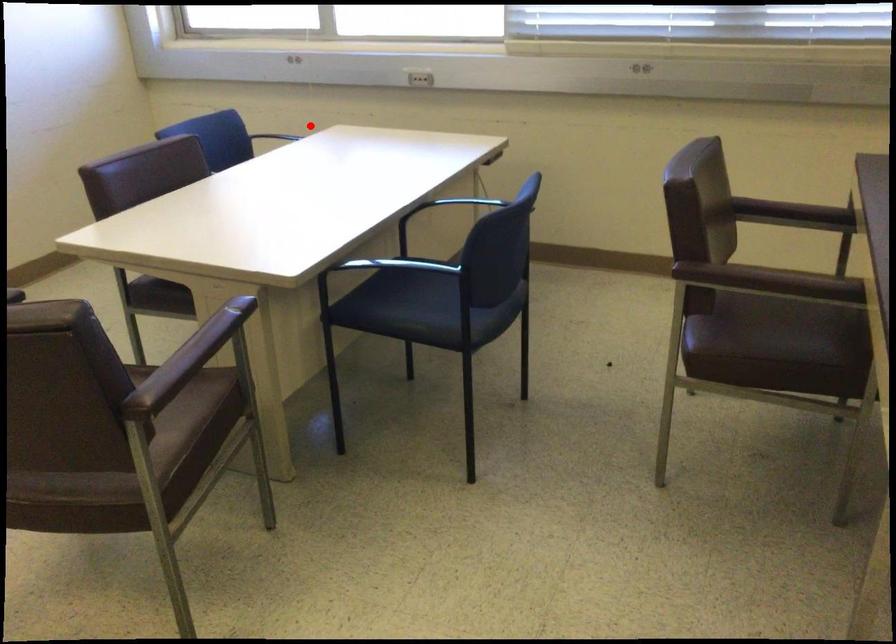
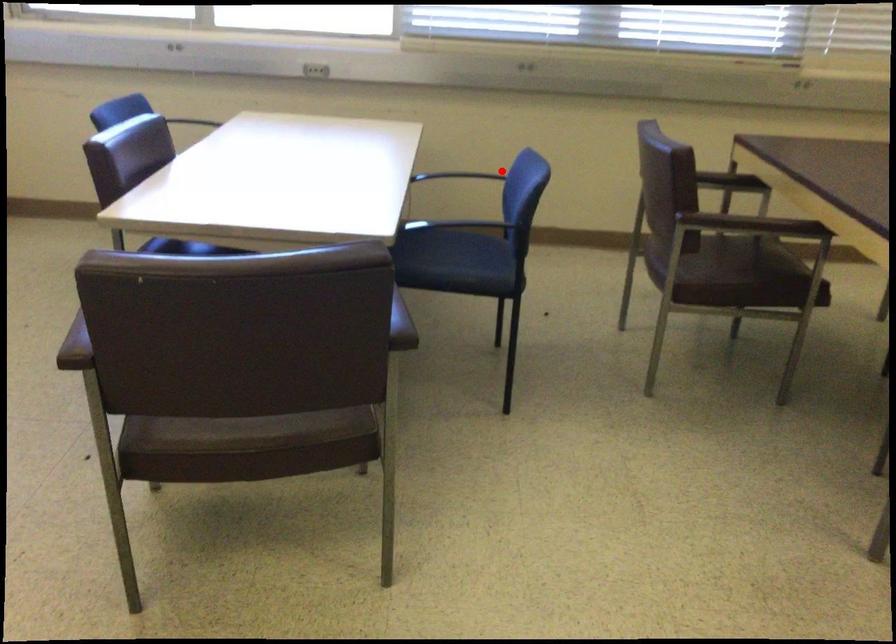
I am providing you with two images of the same scene from different viewpoints. A red point is marked on the first image and another point is marked on the second image. Is the marked point in image1 the same physical position as the marked point in image2?

No